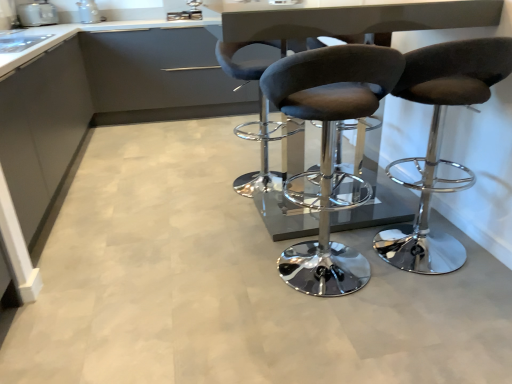
Question: From the image's perspective, does suede-like brown stool at center, arranged as the first chair when viewed from the right, appear lower than dark gray fabric stool at center, the first chair in the left-to-right sequence?

Choices:
 (A) yes
 (B) no

Answer: (A)

Question: From a real-world perspective, is suede-like brown stool at center, arranged as the first chair when viewed from the right, over dark gray fabric stool at center, the first chair in the left-to-right sequence?

Choices:
 (A) yes
 (B) no

Answer: (A)

Question: Is suede-like brown stool at center, arranged as the first chair when viewed from the right, directly adjacent to dark gray fabric stool at center, which is the 3th chair from right to left?

Choices:
 (A) no
 (B) yes

Answer: (A)

Question: Is suede-like brown stool at center, arranged as the first chair when viewed from the right, far away from dark gray fabric stool at center, the first chair in the left-to-right sequence?

Choices:
 (A) no
 (B) yes

Answer: (A)

Question: Does suede-like brown stool at center, the third chair from the left, have a lesser width compared to dark gray fabric stool at center, the first chair in the left-to-right sequence?

Choices:
 (A) no
 (B) yes

Answer: (A)

Question: Is dark gray fabric stool at center, which is the 3th chair from right to left, taller or shorter than white glossy toaster at upper left, which is the first appliance from right to left?

Choices:
 (A) tall
 (B) short

Answer: (A)

Question: Based on their sizes in the image, would you say dark gray fabric stool at center, which is the 3th chair from right to left, is bigger or smaller than white glossy toaster at upper left, which is the first appliance from right to left?

Choices:
 (A) small
 (B) big

Answer: (B)

Question: From a real-world perspective, relative to white glossy toaster at upper left, which is the first appliance from right to left, is dark gray fabric stool at center, which is the 3th chair from right to left, vertically above or below?

Choices:
 (A) below
 (B) above

Answer: (A)

Question: Is dark gray fabric stool at center, the first chair in the left-to-right sequence, in front of or behind white glossy toaster at upper left, which is the first appliance from right to left, in the image?

Choices:
 (A) front
 (B) behind

Answer: (A)

Question: Is matte gray cabinet at left to the left or to the right of metallic gray table at center in the image?

Choices:
 (A) left
 (B) right

Answer: (A)

Question: Is matte gray cabinet at left in front of or behind metallic gray table at center in the image?

Choices:
 (A) front
 (B) behind

Answer: (A)

Question: From the image's perspective, is matte gray cabinet at left located above or below metallic gray table at center?

Choices:
 (A) below
 (B) above

Answer: (B)

Question: Is matte gray cabinet at left bigger or smaller than metallic gray table at center?

Choices:
 (A) small
 (B) big

Answer: (B)

Question: Is suede-like brown stool at center, arranged as the first chair when viewed from the right, in front of or behind white glossy toaster at upper left, which is the first appliance from right to left, in the image?

Choices:
 (A) behind
 (B) front

Answer: (B)

Question: In terms of size, does suede-like brown stool at center, the third chair from the left, appear bigger or smaller than white glossy toaster at upper left, the second appliance in the left-to-right sequence?

Choices:
 (A) big
 (B) small

Answer: (A)